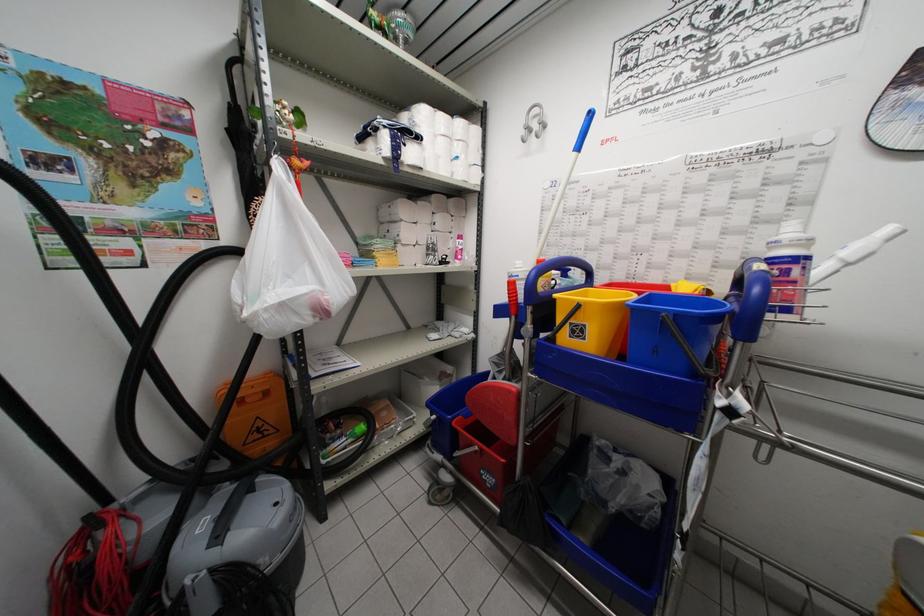
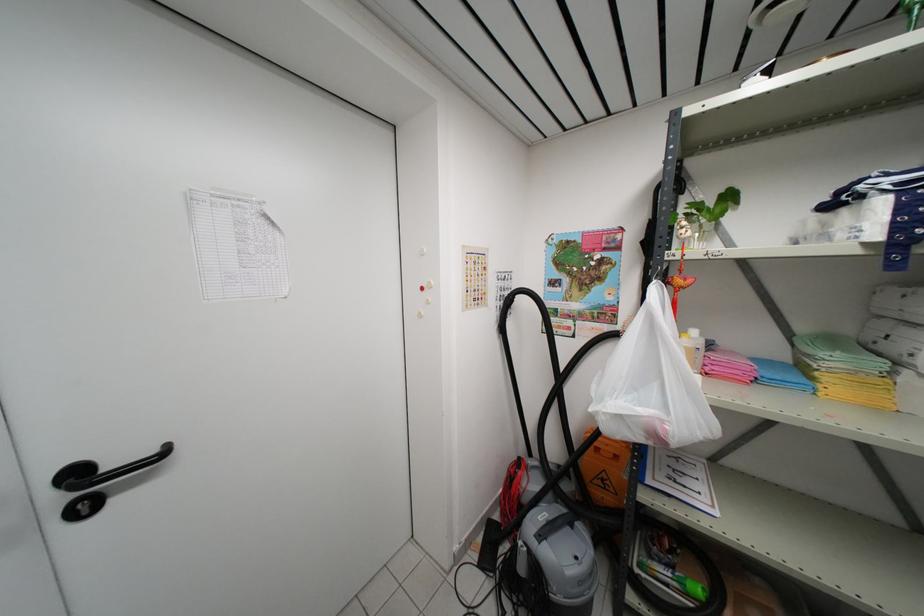
Where in the second image is the point corresponding to [269,437] from the first image?

(610, 492)